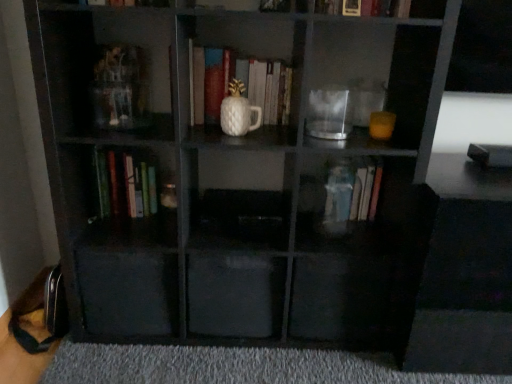
Locate an element on the screen. This screenshot has height=384, width=512. free space above transparent plastic drawer at lower left, the 1th drawer when ordered from left to right (from a real-world perspective) is located at coordinates (133, 235).